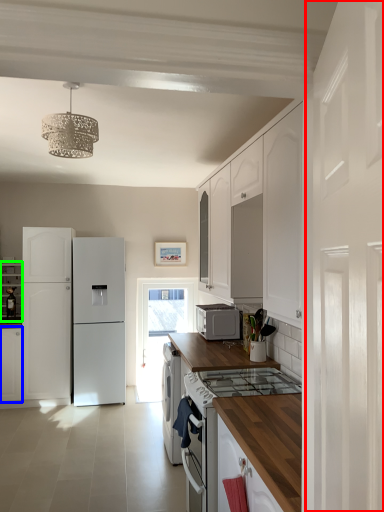
Question: Which object is positioned farthest from side (highlighted by a red box)? Select from cabinetry (highlighted by a blue box) and cabinetry (highlighted by a green box).

Choices:
 (A) cabinetry
 (B) cabinetry

Answer: (B)